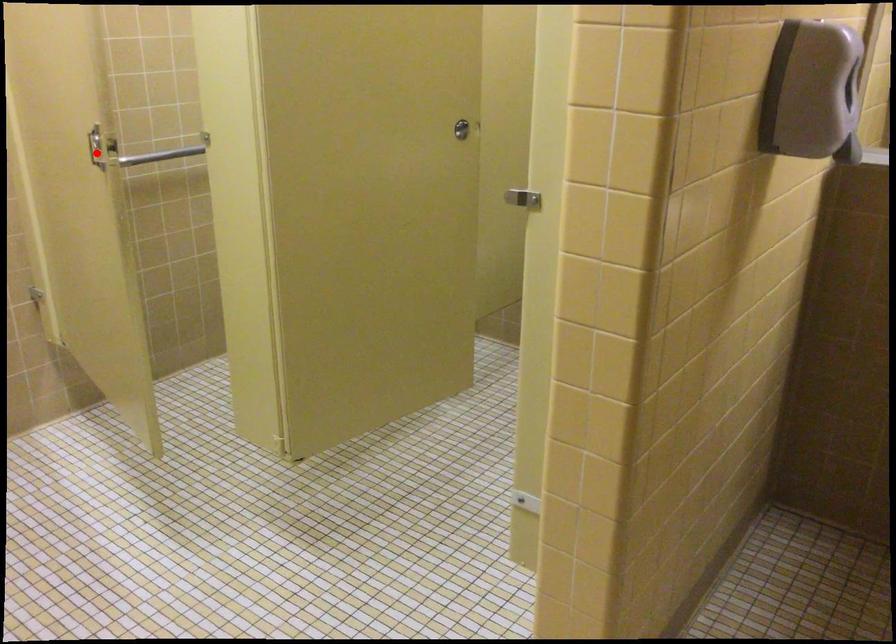
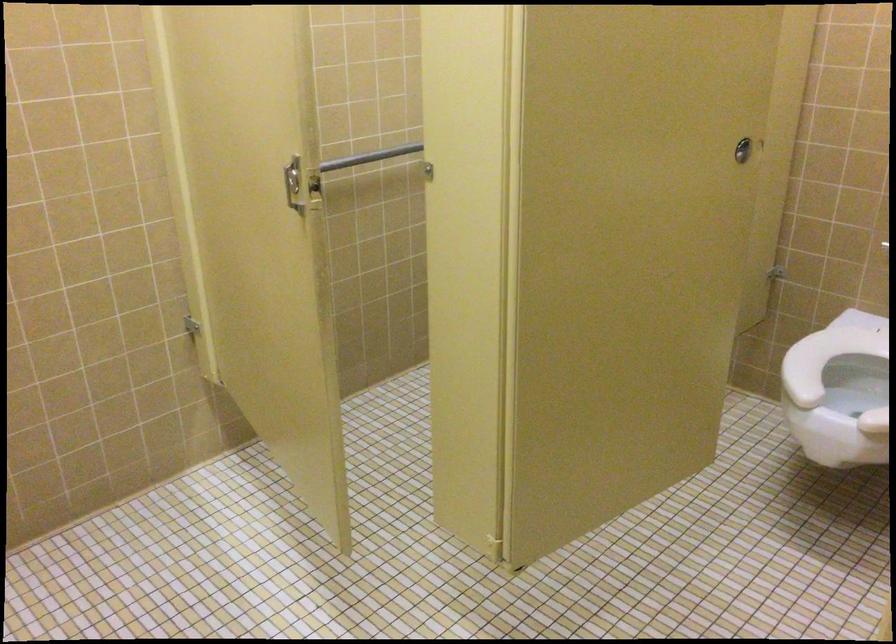
Where in the second image is the point corresponding to the highlighted location from the first image?

(293, 184)